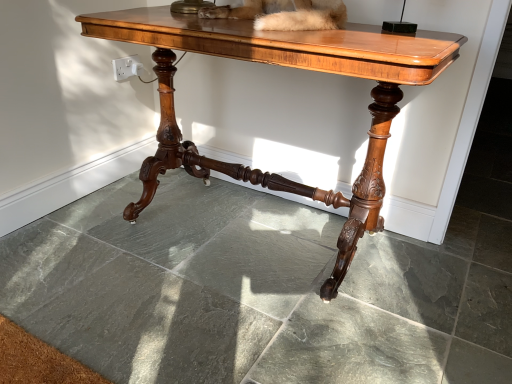
Locate an element on the screen. free spot below shiny wood table at center (from a real-world perspective) is located at coordinates (252, 228).